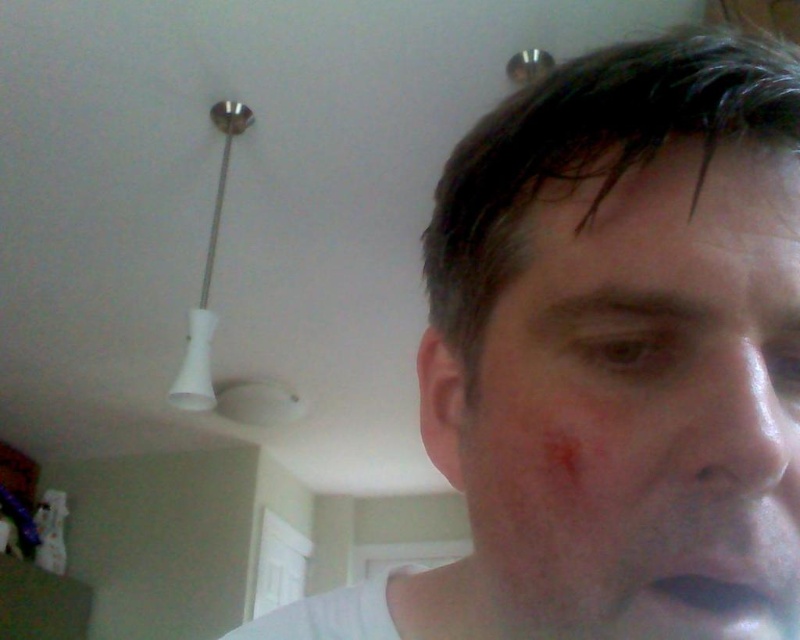
Question: Which of the following is the farthest from the observer?

Choices:
 (A) (713, 154)
 (B) (676, 627)
 (C) (748, 333)
 (D) (760, 419)

Answer: (A)

Question: Is smooth skin scar at center bigger than dry skin at upper center?

Choices:
 (A) yes
 (B) no

Answer: (A)

Question: Is smooth skin nose at center to the left of matte white lips at lower right from the viewer's perspective?

Choices:
 (A) yes
 (B) no

Answer: (B)

Question: Which point is closer to the camera?

Choices:
 (A) (517, 237)
 (B) (716, 344)
 (C) (638, 228)
 (D) (636, 256)

Answer: (B)

Question: Which of the following is the farthest from the observer?

Choices:
 (A) smooth skin nose at center
 (B) matte white lips at lower right
 (C) dry skin at upper center

Answer: (C)

Question: Can you confirm if matte white face at upper right is bigger than dry skin at upper center?

Choices:
 (A) no
 (B) yes

Answer: (B)